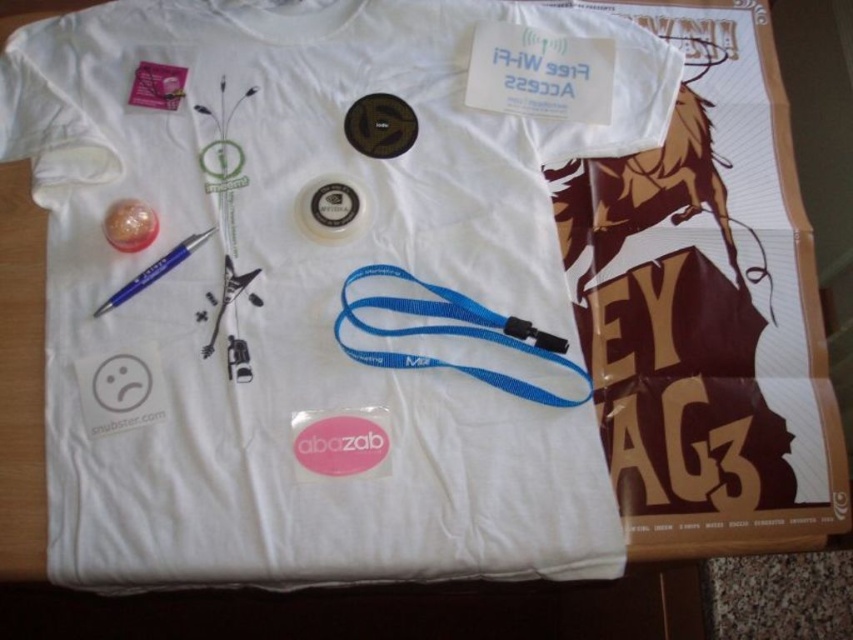
Which is behind, point (506, 435) or point (158, 374)?

Point (158, 374)

Looking at this image, is white fabric t-shirt at center in front of white matte sad face at lower left?

Yes, white fabric t-shirt at center is closer to the viewer.

What do you see at coordinates (326, 284) in the screenshot? I see `white fabric t-shirt at center` at bounding box center [326, 284].

I want to click on white fabric t-shirt at center, so click(x=326, y=284).

Does white fabric t-shirt at center appear under metallic silver guitar at center?

Result: No, white fabric t-shirt at center is not below metallic silver guitar at center.

Can you confirm if white fabric t-shirt at center is wider than metallic silver guitar at center?

Yes, white fabric t-shirt at center is wider than metallic silver guitar at center.

Find the location of `white fabric t-shirt at center`. white fabric t-shirt at center is located at coordinates (326, 284).

Does white paper poster at upper right have a lesser width compared to white matte sad face at lower left?

No, white paper poster at upper right is not thinner than white matte sad face at lower left.

Who is positioned more to the right, white paper poster at upper right or white matte sad face at lower left?

From the viewer's perspective, white paper poster at upper right appears more on the right side.

Does point (781, 170) lie in front of point (149, 358)?

No, (781, 170) is behind (149, 358).

Find the location of `white paper poster at upper right`. white paper poster at upper right is located at coordinates (706, 304).